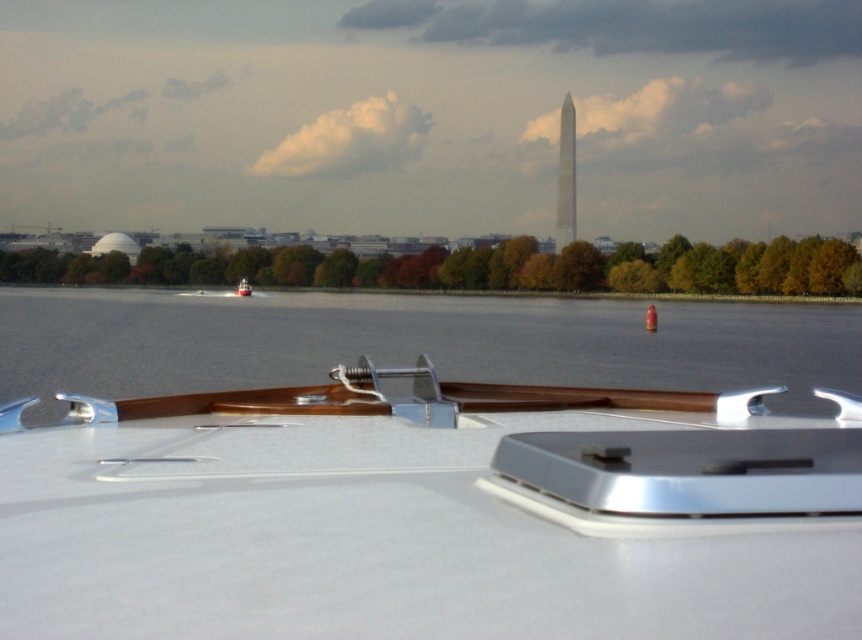
Question: Which is nearer to the white glossy boat at center?

Choices:
 (A) smooth stone tower at center
 (B) clear water at center

Answer: (B)

Question: Which object is closer to the camera taking this photo?

Choices:
 (A) metallic red boat at center
 (B) smooth stone tower at center
 (C) clear water at center

Answer: (C)

Question: Is white glossy boat at center thinner than metallic red boat at center?

Choices:
 (A) yes
 (B) no

Answer: (A)

Question: Which point appears farthest from the camera in this image?

Choices:
 (A) (563, 154)
 (B) (557, 305)
 (C) (354, 368)
 (D) (239, 291)

Answer: (A)

Question: Is white glossy boat at center smaller than smooth stone tower at center?

Choices:
 (A) yes
 (B) no

Answer: (A)

Question: In this image, where is smooth stone tower at center located relative to metallic red boat at center?

Choices:
 (A) left
 (B) right

Answer: (B)